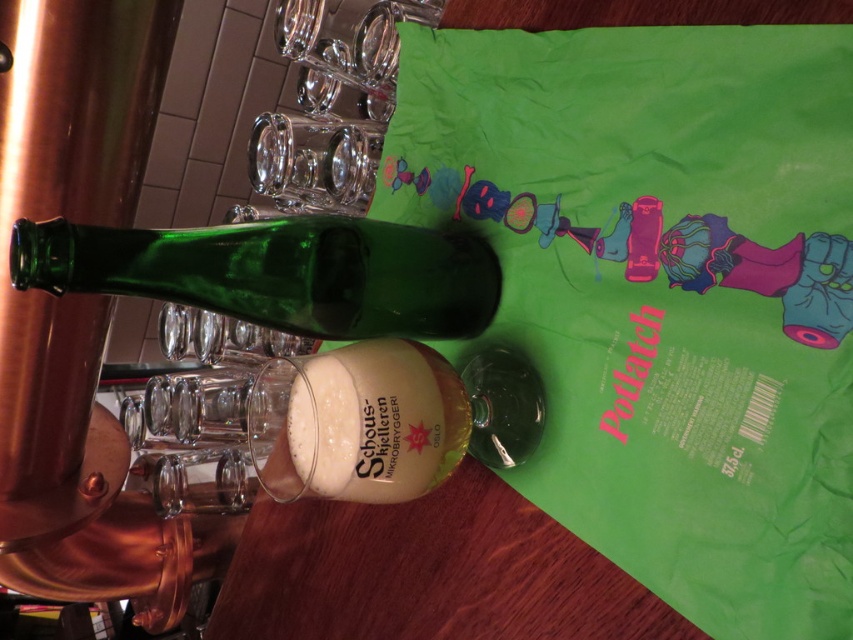
You are a bartender preparing a drink. You have a green glass bottle at center and a translucent glass mug at center on the table. Which object should you pick up first if you need to pour the beer from the bottle into the mug without spilling?

You should pick up the translucent glass mug at center first to position it under the green glass bottle at center, as the bottle is located above the mug.